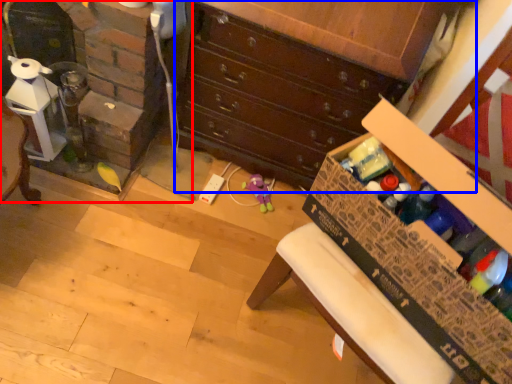
Question: Which object is closer to the camera taking this photo, fireplace (highlighted by a red box) or chest of drawers (highlighted by a blue box)?

Choices:
 (A) fireplace
 (B) chest of drawers

Answer: (B)